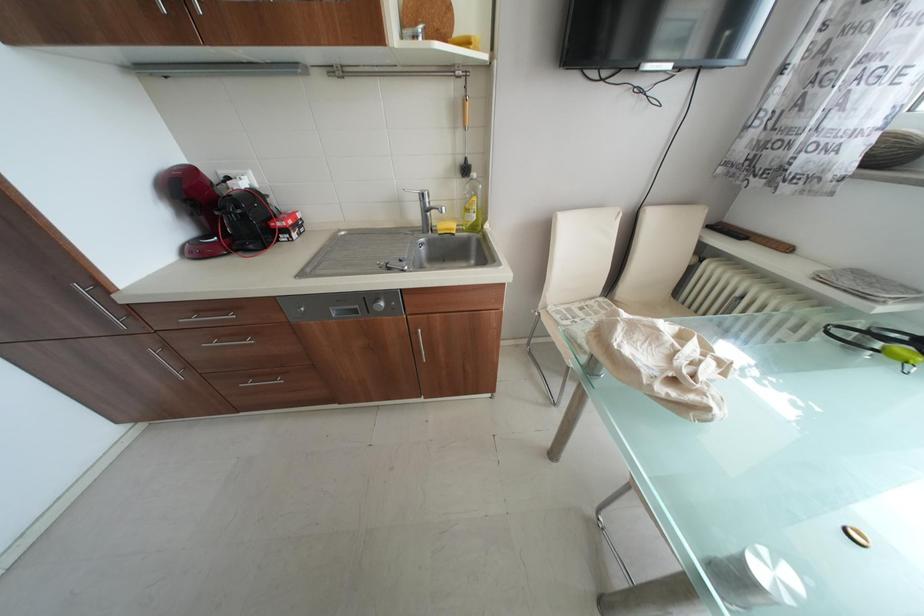
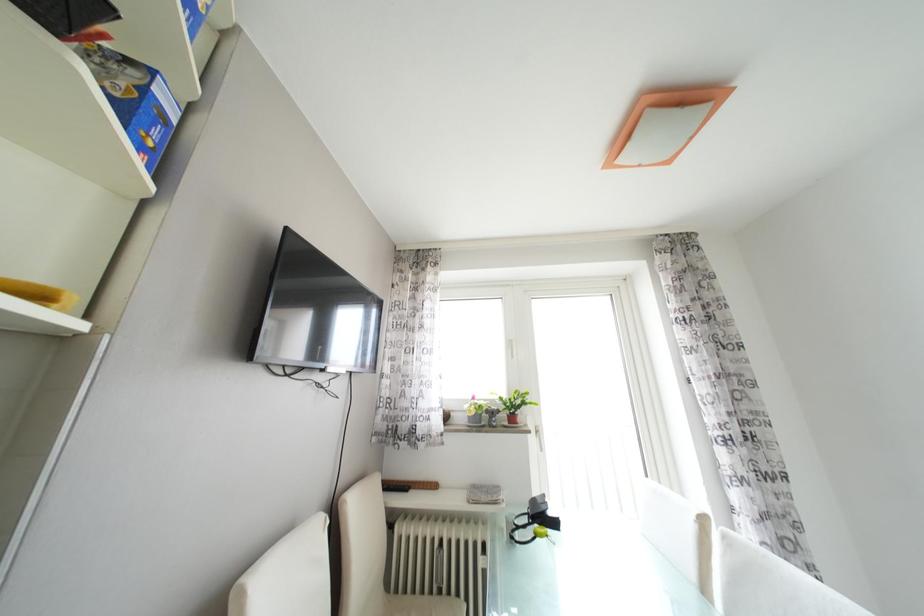
Based on the continuous images, in which direction is the camera rotating?

The camera's rotation is toward right-up.